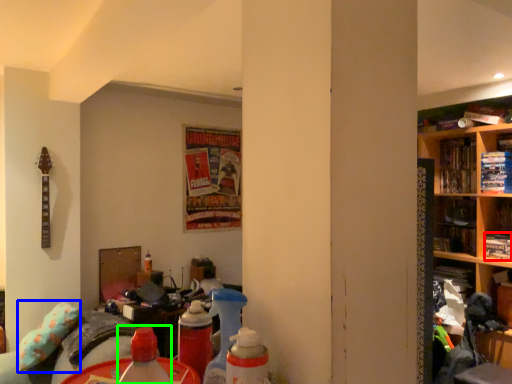
Question: Considering the real-world distances, which object is closest to book (highlighted by a red box)? pillow (highlighted by a blue box) or bottle (highlighted by a green box).

Choices:
 (A) pillow
 (B) bottle

Answer: (A)